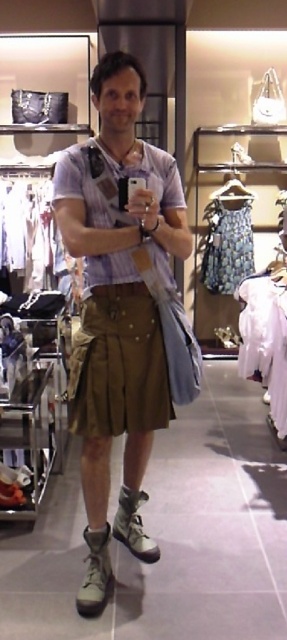
Question: Does brown cotton kilt at center have a greater width compared to brown pleated kilt at center?

Choices:
 (A) yes
 (B) no

Answer: (A)

Question: Is brown pleated kilt at center bigger than printed fabric dress at center?

Choices:
 (A) yes
 (B) no

Answer: (B)

Question: Is brown cotton kilt at center below printed fabric dress at center?

Choices:
 (A) yes
 (B) no

Answer: (A)

Question: Considering the real-world distances, which object is closest to the printed fabric dress at center?

Choices:
 (A) brown pleated kilt at center
 (B) brown cotton kilt at center

Answer: (B)

Question: Among these points, which one is nearest to the camera?

Choices:
 (A) coord(92,346)
 (B) coord(214,256)

Answer: (A)

Question: Estimate the real-world distances between objects in this image. Which object is farther from the printed fabric dress at center?

Choices:
 (A) brown pleated kilt at center
 (B) brown cotton kilt at center

Answer: (A)